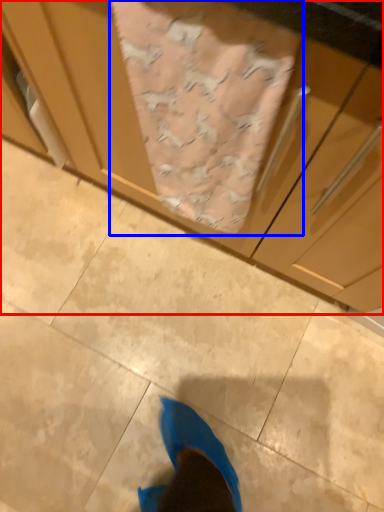
Question: Which point is further to the camera, cabinetry (highlighted by a red box) or blanket (highlighted by a blue box)?

Choices:
 (A) cabinetry
 (B) blanket

Answer: (B)